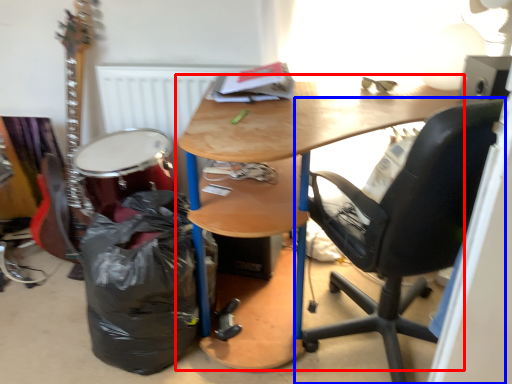
Question: Which point is further to the camera, desk (highlighted by a red box) or chair (highlighted by a blue box)?

Choices:
 (A) desk
 (B) chair

Answer: (A)